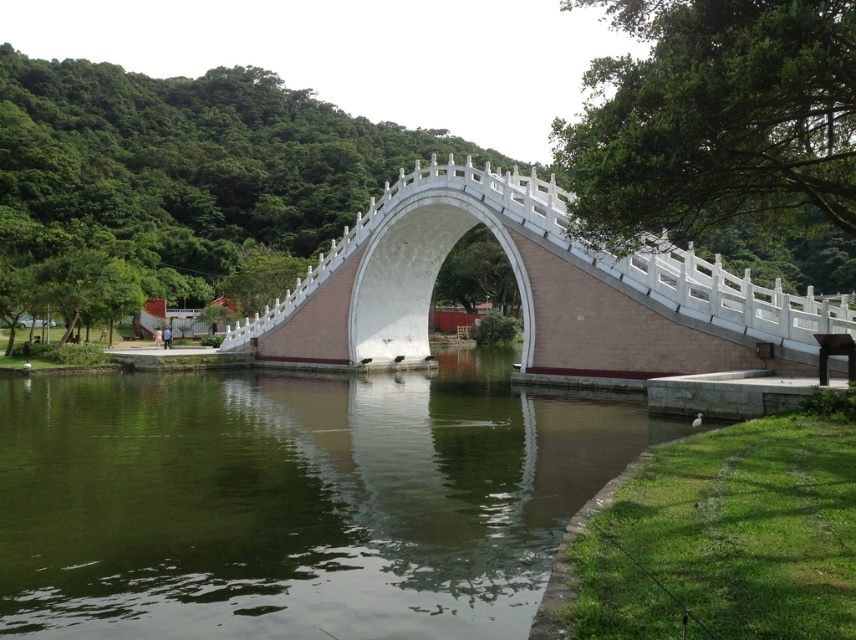
Who is higher up, green smooth water at center or white stone bridge at center?

white stone bridge at center

Does green smooth water at center have a greater width compared to white stone bridge at center?

Indeed, green smooth water at center has a greater width compared to white stone bridge at center.

Image resolution: width=856 pixels, height=640 pixels. I want to click on green smooth water at center, so click(x=294, y=500).